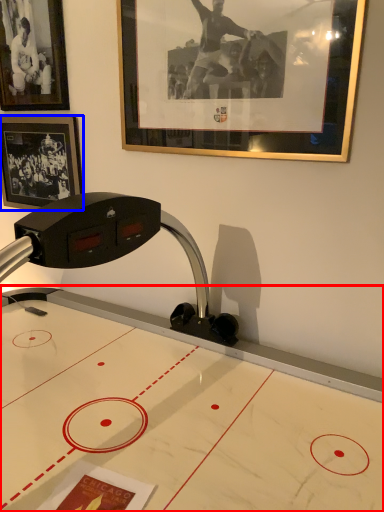
Question: Which point is further to the camera, table (highlighted by a red box) or picture frame (highlighted by a blue box)?

Choices:
 (A) table
 (B) picture frame

Answer: (B)